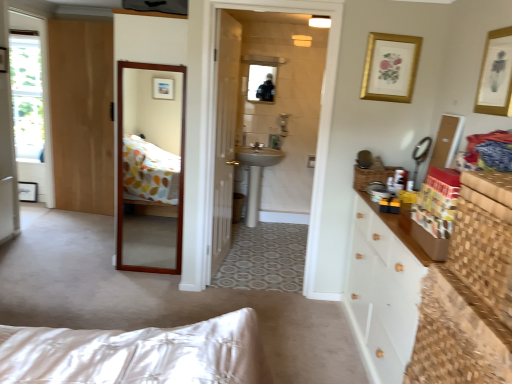
Question: From the image's perspective, is satin nickel faucet at center located above or below white satin bed at lower left?

Choices:
 (A) below
 (B) above

Answer: (B)

Question: Considering the positions of satin nickel faucet at center and white satin bed at lower left in the image, is satin nickel faucet at center wider or thinner than white satin bed at lower left?

Choices:
 (A) thin
 (B) wide

Answer: (A)

Question: Considering the real-world distances, which object is closest to the woven wood chest at right, the second cabinetry when ordered from back to front?

Choices:
 (A) wooden mirror at center
 (B) white ceramic sink at center
 (C) translucent glass door at center, the second door when ordered from back to front
 (D) metallic silver mirror at upper right, the first mirror ordered from the bottom
 (E) glossy glass mirror at upper center, the 2th mirror from the bottom

Answer: (D)

Question: Estimate the real-world distances between objects in this image. Which object is farther from the wooden drawer at center-right?

Choices:
 (A) metallic silver mirror at upper right, the second mirror from the back
 (B) transparent glass window at upper left
 (C) white ceramic sink at center
 (D) translucent glass door at center, the second door in the left-to-right sequence
 (E) satin nickel faucet at center

Answer: (B)